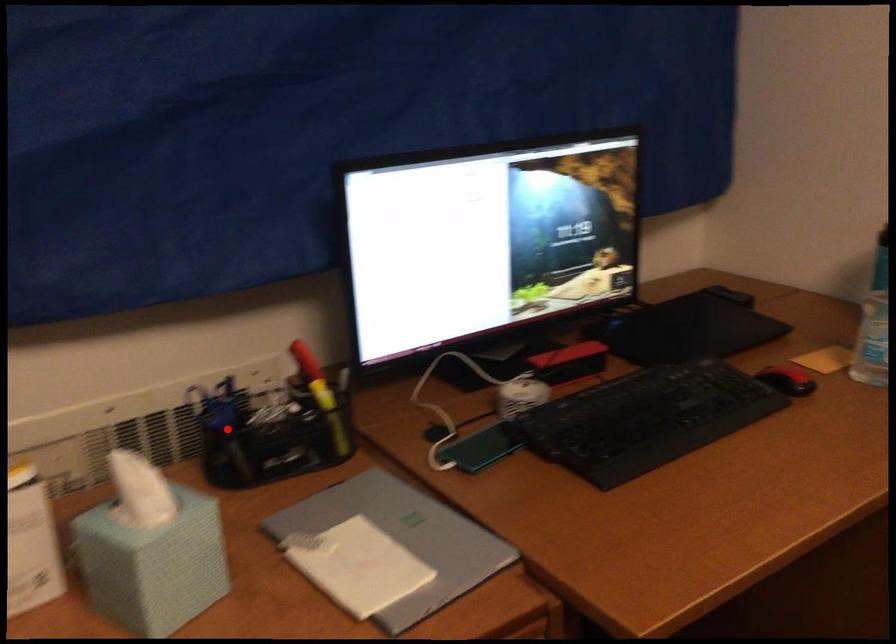
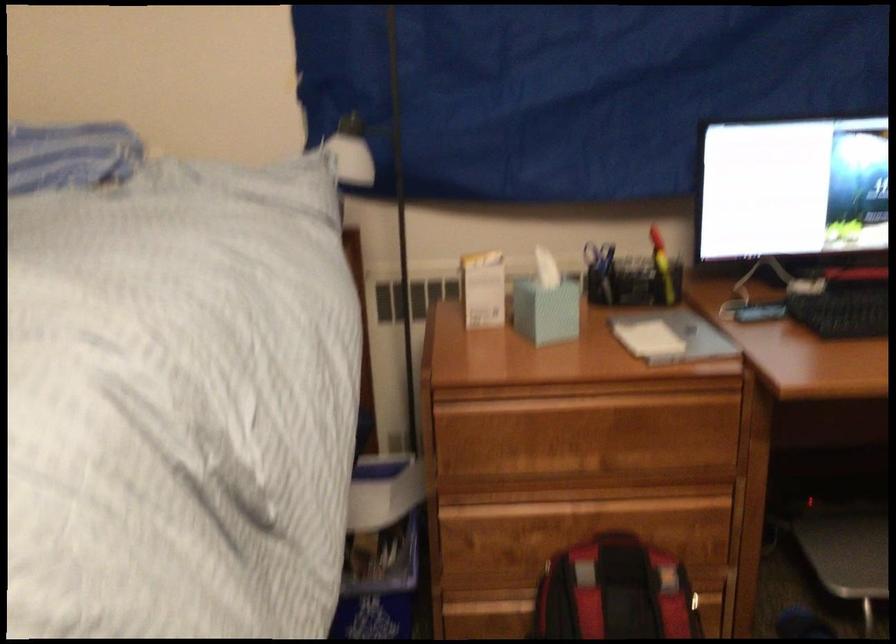
Question: I am providing you with two images of the same scene from different viewpoints. Image1 has a red point marked. In image2, the corresponding 3D location appears at what relative position? Reply with the corresponding letter.

Choices:
 (A) Closer
 (B) Farther

Answer: (B)